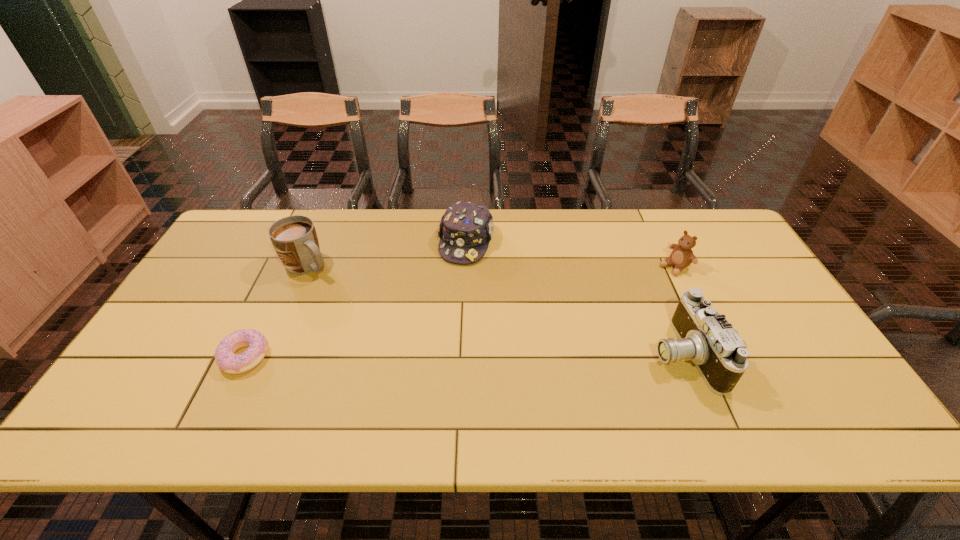
Identify the location of the shortest object. The image size is (960, 540). (257, 344).

At what (x,y) coordinates should I click in order to perform the action: click on camera. Please return your answer as a coordinate pair (x, y). This screenshot has width=960, height=540. Looking at the image, I should click on (705, 337).

Identify the location of teddy bear. (682, 255).

Locate an element on the screen. mug is located at coordinates (294, 238).

Find the location of a particular element. headwear is located at coordinates [x=466, y=228].

Where is `vacant space located 0.080m on the right of the shortest object`? This screenshot has height=540, width=960. vacant space located 0.080m on the right of the shortest object is located at coordinates click(x=300, y=356).

Where is `vacant space situated 0.220m at the lens of the camera`? vacant space situated 0.220m at the lens of the camera is located at coordinates (564, 354).

Image resolution: width=960 pixels, height=540 pixels. In order to click on vacant region located 0.230m at the lens of the camera in this screenshot , I will do `click(560, 354)`.

The height and width of the screenshot is (540, 960). I want to click on free space located 0.310m at the lens of the camera, so click(527, 354).

Identify the location of vacant space positioned 0.390m on the front-facing side of the teddy bear. The width and height of the screenshot is (960, 540). (568, 328).